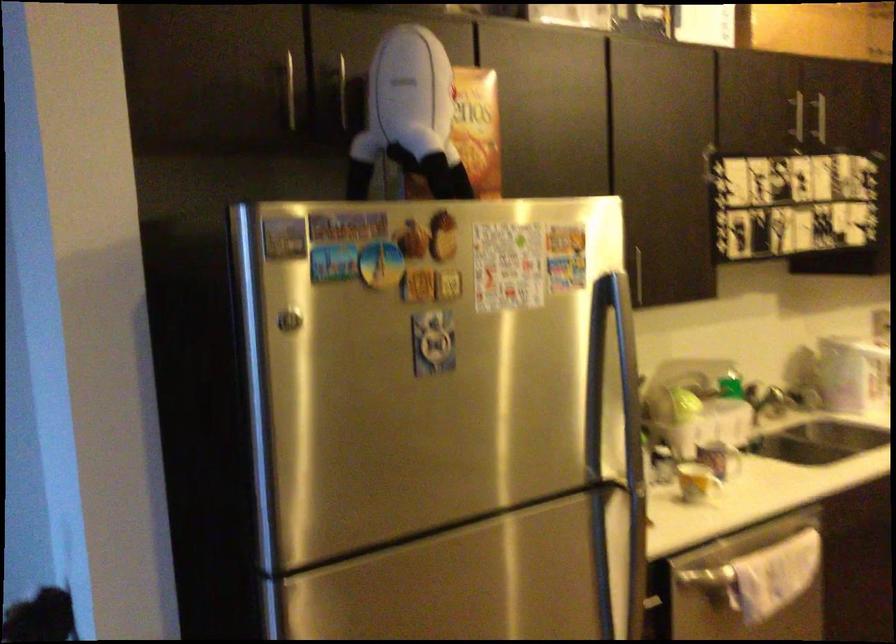
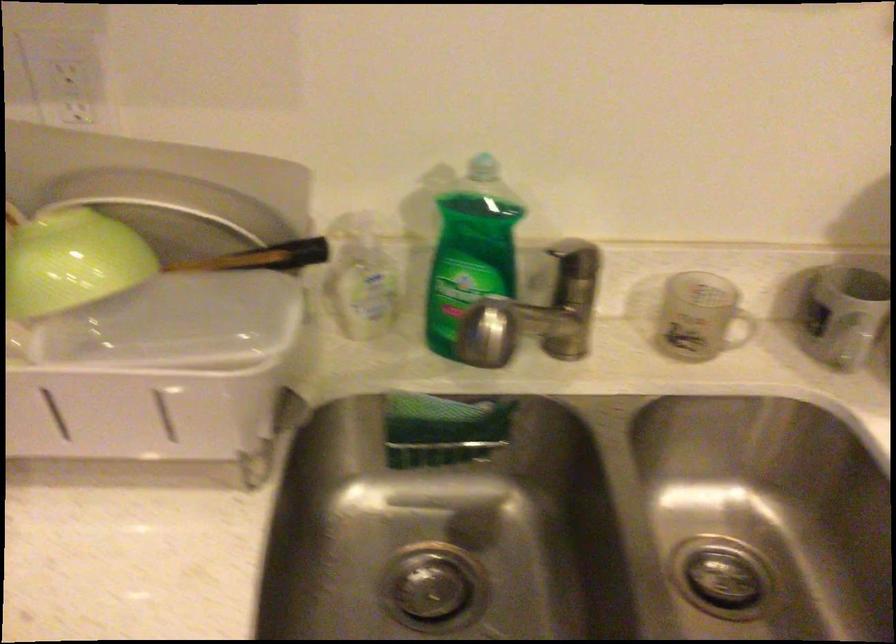
Locate, in the second image, the point that corresponds to the point at 678,391 in the first image.

(71, 261)